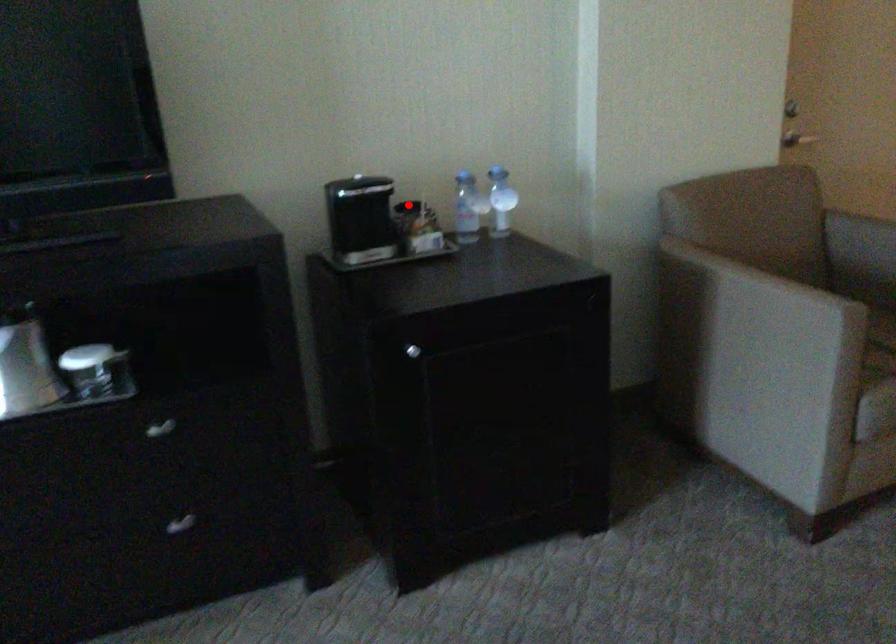
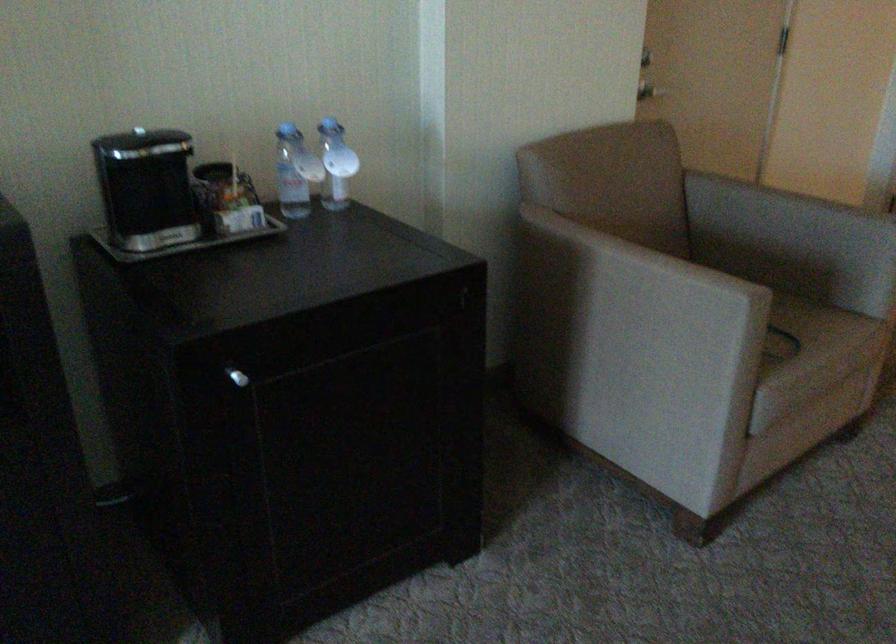
The point at the highlighted location is marked in the first image. Where is the corresponding point in the second image?

(212, 171)